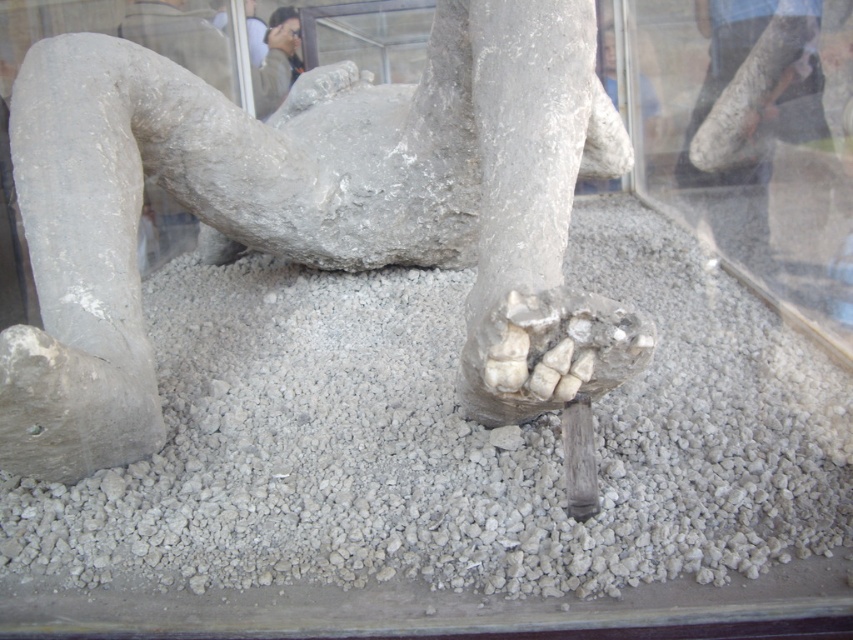
Does point (532, 522) lie in front of point (138, 340)?

Yes, point (532, 522) is closer to viewer.

Does gray gravel at center have a larger size compared to gray stone statue at center?

Result: Indeed, gray gravel at center has a larger size compared to gray stone statue at center.

What do you see at coordinates (451, 440) in the screenshot? I see `gray gravel at center` at bounding box center [451, 440].

The width and height of the screenshot is (853, 640). In order to click on gray gravel at center in this screenshot , I will do `click(451, 440)`.